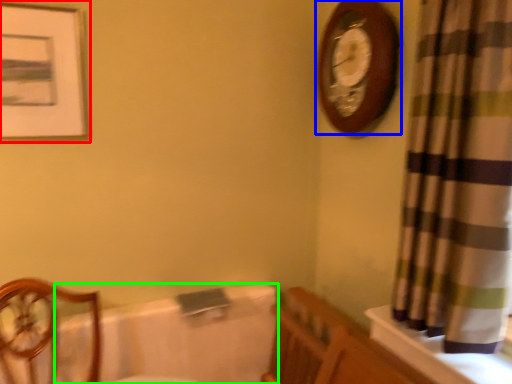
Question: Which is nearer to the picture frame (highlighted by a red box)? wall clock (highlighted by a blue box) or bath (highlighted by a green box).

Choices:
 (A) wall clock
 (B) bath

Answer: (B)